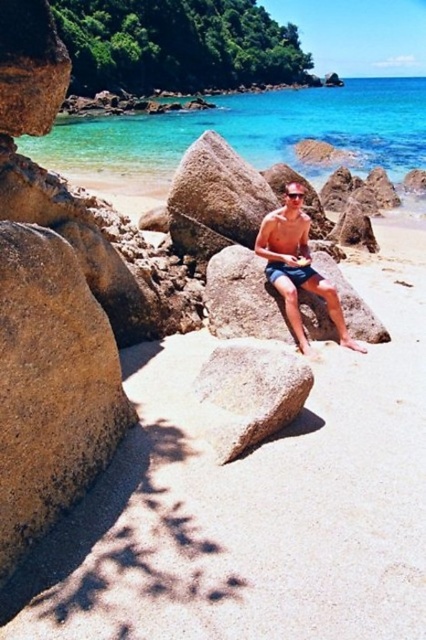
You are a photographer trying to capture a candid shot of the person at the beach. The smooth brown rock at center and the nude skin at center are both in your frame. Since you want to ensure the rock doesn not block the person, which object should you position closer to the camera?

You should position the nude skin at center closer to the camera because the smooth brown rock at center is taller than the nude skin at center, so bringing the person forward would keep them visible and prevent the rock from obscuring them.

You are standing on the beach and want to walk from the smooth brown rock at center to the clear blue water at upper center. Which direction should you move to get closer to the water?

You should move forward towards the clear blue water at upper center because it is closer to you than the smooth brown rock at center.

You are standing on the beach and want to take a photo of the clear blue water at upper center and the smooth brown rock at center. Which object should you focus on first if you want both to be in the frame without moving the camera?

The clear blue water at upper center is positioned over the smooth brown rock at center, so you should focus on the smooth brown rock at center first to ensure it is in focus before the water, as it is closer to the camera.